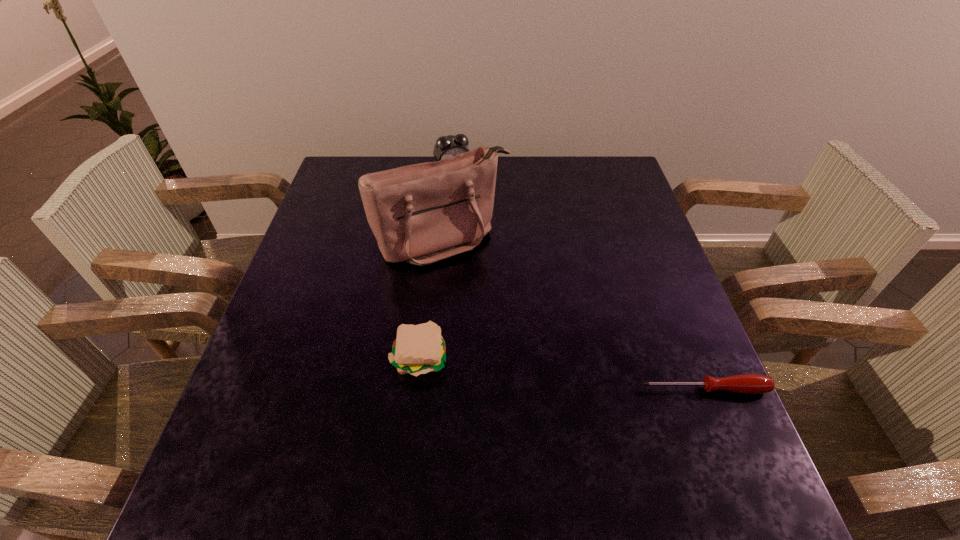
Where is `patty`? This screenshot has height=540, width=960. patty is located at coordinates (418, 349).

Where is `the shortest object`? The height and width of the screenshot is (540, 960). the shortest object is located at coordinates (749, 383).

You are a GUI agent. You are given a task and a screenshot of the screen. Output one action in this format:
    pyautogui.click(x=<x>, y=<y>)
    Task: Click on the rightmost object
    The width and height of the screenshot is (960, 540).
    Given the screenshot: What is the action you would take?
    pyautogui.click(x=749, y=383)

Locate an element on the screen. The image size is (960, 540). shoulder bag is located at coordinates (420, 214).

Locate an element on the screen. This screenshot has height=540, width=960. the second farthest object is located at coordinates (420, 214).

The height and width of the screenshot is (540, 960). Find the location of `the third shortest object`. the third shortest object is located at coordinates (448, 146).

Where is `alarm clock`? alarm clock is located at coordinates (448, 146).

Locate an element on the screen. The image size is (960, 540). vacant space located on the left of the patty is located at coordinates (353, 357).

The height and width of the screenshot is (540, 960). In order to click on free spot located 0.050m on the front pocket of the shoulder bag in this screenshot , I will do `click(482, 280)`.

Image resolution: width=960 pixels, height=540 pixels. Find the location of `vacant space located on the front pocket of the shoulder bag`. vacant space located on the front pocket of the shoulder bag is located at coordinates (507, 314).